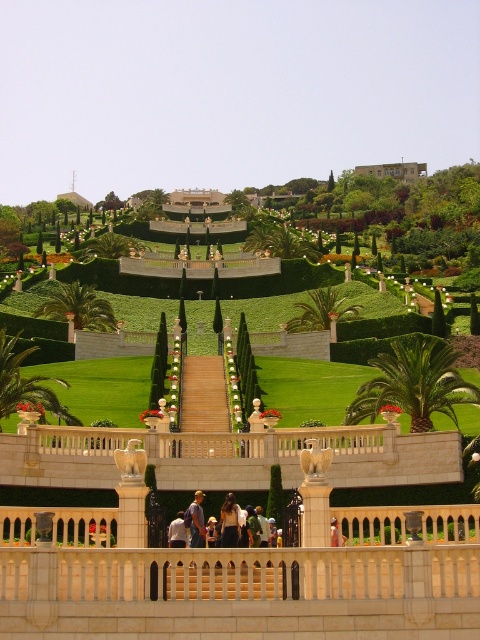
You are standing at the point labeled point at (199, 579) in the garden. You need to walk to a statue located 42.20 meters away from your current position. Is there enough space between the stone balustrade and the nearest hedge to walk straight towards the statue without encountering any obstacles?

The distance between the point at (199, 579) and the statue is 42.20 meters. However, the garden has stone balustrades and hedges along the pathways, so there might be obstacles in the direct path. To determine if there is enough space, one would need to know the exact layout and spacing between these features. Since the description mentions the stone balustrade in the foreground and hedges flanking the stairs, it is possible that the straight path could be obstructed by these structures. Therefore, it is

You are a visitor standing at the bottom of the wooden stairs at center, looking up towards the beige stone building at upper center. Which object appears larger in your view?

The beige stone building at upper center appears larger in your view because it is closer to you than the wooden stairs at center, which is smaller in size.

You are standing at the entrance of the garden and see the point marked at coordinates (224, 580). What is located at that point?

The point at coordinates (224, 580) indicates wooden stairs at center.